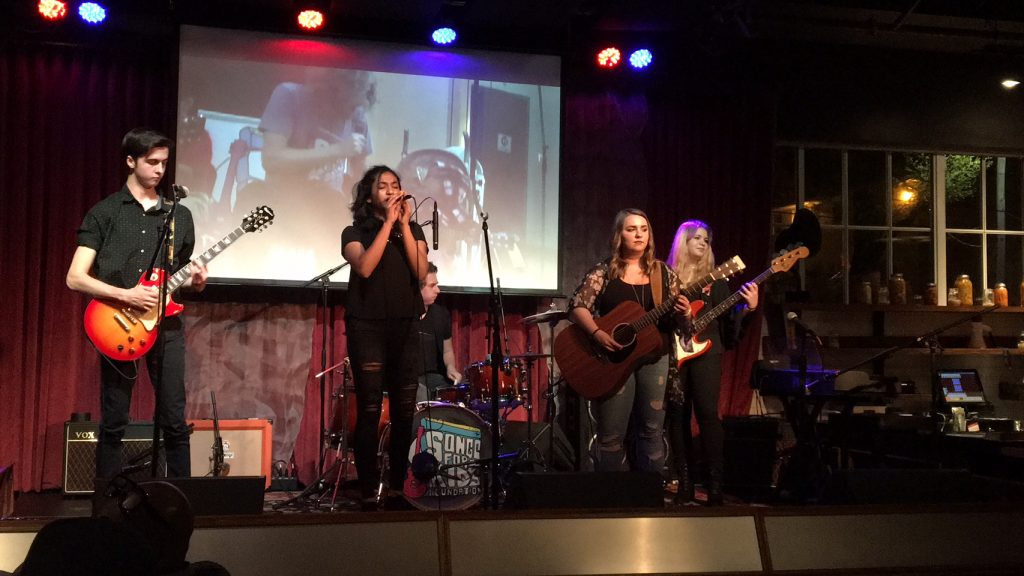
You are a GUI agent. You are given a task and a screenshot of the screen. Output one action in this format:
    pyautogui.click(x=<x>, y=<y>)
    Task: Click on the monitor
    Image resolution: width=1024 pixels, height=576 pixels.
    Given the screenshot: What is the action you would take?
    pyautogui.click(x=965, y=391)